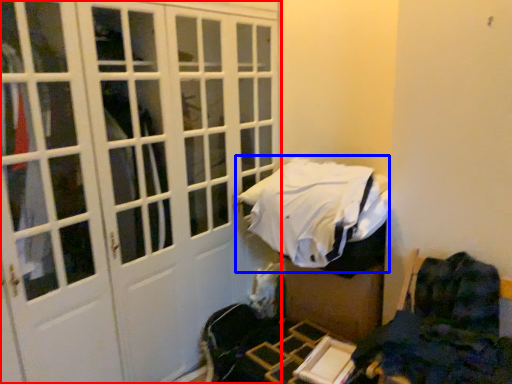
Question: Which object appears closest to the camera in this image, door (highlighted by a red box) or bed (highlighted by a blue box)?

Choices:
 (A) door
 (B) bed

Answer: (A)